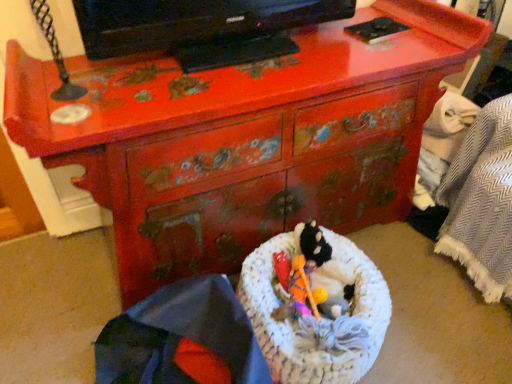
Question: From the image's perspective, is black glossy tv at upper center under white knitted laundry basket at center?

Choices:
 (A) no
 (B) yes

Answer: (A)

Question: Can you confirm if black glossy tv at upper center is taller than white knitted laundry basket at center?

Choices:
 (A) yes
 (B) no

Answer: (A)

Question: Is black glossy tv at upper center bigger than white knitted laundry basket at center?

Choices:
 (A) no
 (B) yes

Answer: (A)

Question: Is black glossy tv at upper center looking in the opposite direction of white knitted laundry basket at center?

Choices:
 (A) yes
 (B) no

Answer: (B)

Question: From the image's perspective, would you say black glossy tv at upper center is positioned over white knitted laundry basket at center?

Choices:
 (A) yes
 (B) no

Answer: (A)

Question: In terms of width, does woven fabric basket at lower center look wider or thinner when compared to black glossy tv at upper center?

Choices:
 (A) wide
 (B) thin

Answer: (A)

Question: Visually, is woven fabric basket at lower center positioned to the left or to the right of black glossy tv at upper center?

Choices:
 (A) right
 (B) left

Answer: (B)

Question: In terms of height, does woven fabric basket at lower center look taller or shorter compared to black glossy tv at upper center?

Choices:
 (A) short
 (B) tall

Answer: (B)

Question: Considering the positions of woven fabric basket at lower center and black glossy tv at upper center in the image, is woven fabric basket at lower center bigger or smaller than black glossy tv at upper center?

Choices:
 (A) small
 (B) big

Answer: (B)

Question: From their relative heights in the image, would you say black glossy tv at upper center is taller or shorter than white knitted laundry basket at center?

Choices:
 (A) tall
 (B) short

Answer: (A)

Question: Looking at their shapes, would you say black glossy tv at upper center is wider or thinner than white knitted laundry basket at center?

Choices:
 (A) thin
 (B) wide

Answer: (A)

Question: From the image's perspective, is black glossy tv at upper center positioned above or below white knitted laundry basket at center?

Choices:
 (A) above
 (B) below

Answer: (A)

Question: In the image, is black glossy tv at upper center on the left side or the right side of white knitted laundry basket at center?

Choices:
 (A) right
 (B) left

Answer: (B)

Question: Does point (176, 370) appear closer or farther from the camera than point (320, 367)?

Choices:
 (A) farther
 (B) closer

Answer: (A)

Question: In terms of width, does woven fabric basket at lower center look wider or thinner when compared to white knitted laundry basket at center?

Choices:
 (A) thin
 (B) wide

Answer: (B)